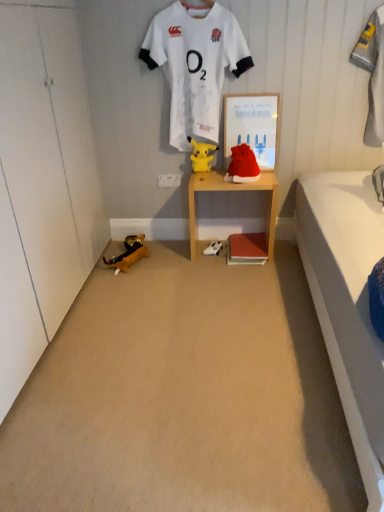
The width and height of the screenshot is (384, 512). What are the coordinates of `unoccupied area in front of yellow plush toy at lower left, the first toy from the bottom` in the screenshot? It's located at (136, 276).